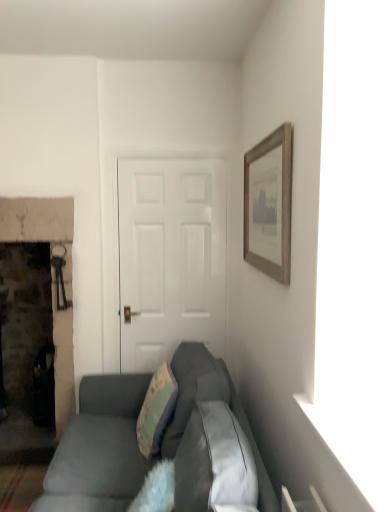
Measure the distance between point (38,405) and camera.

They are 2.91 meters apart.

Where is `wooden framed print at upper right`? wooden framed print at upper right is located at coordinates (269, 204).

Where is `trash bin/can below the wooden framed print at upper right (from a real-world perspective)`? This screenshot has height=512, width=384. trash bin/can below the wooden framed print at upper right (from a real-world perspective) is located at coordinates (44, 387).

Is black plastic trash can at left to the left or to the right of wooden framed print at upper right in the image?

black plastic trash can at left is positioned on wooden framed print at upper right's left side.

Is black plastic trash can at left thinner than wooden framed print at upper right?

In fact, black plastic trash can at left might be wider than wooden framed print at upper right.

Consider the image. Is black plastic trash can at left aimed at wooden framed print at upper right?

No, black plastic trash can at left is not facing towards wooden framed print at upper right.

Between black plastic trash can at left and suede gray couch at lower center, which one has smaller width?

black plastic trash can at left is thinner.

From the image's perspective, which is above, black plastic trash can at left or suede gray couch at lower center?

black plastic trash can at left appears higher in the image.

From a real-world perspective, is black plastic trash can at left beneath suede gray couch at lower center?

No, from a real-world perspective, black plastic trash can at left is not below suede gray couch at lower center.

How many degrees apart are the facing directions of black plastic trash can at left and suede gray couch at lower center?

The angular difference between black plastic trash can at left and suede gray couch at lower center is 89.4 degrees.

Is suede gray couch at lower center completely or partially outside of wooden framed print at upper right?

suede gray couch at lower center lies outside wooden framed print at upper right's area.

Between suede gray couch at lower center and wooden framed print at upper right, which one has more height?

suede gray couch at lower center is taller.

Is suede gray couch at lower center in contact with wooden framed print at upper right?

suede gray couch at lower center and wooden framed print at upper right are clearly separated.

From a real-world perspective, which is physically above, suede gray couch at lower center or wooden framed print at upper right?

In real-world perspective, wooden framed print at upper right is above.

Is suede gray couch at lower center touching teal fabric pillow at center?

suede gray couch at lower center is not next to teal fabric pillow at center, and they're not touching.

Which object is closer to the camera, suede gray couch at lower center or teal fabric pillow at center?

suede gray couch at lower center is closer to the camera.

From a real-world perspective, who is located higher, suede gray couch at lower center or teal fabric pillow at center?

teal fabric pillow at center.

Is teal fabric pillow at center located within black plastic trash can at left?

No, teal fabric pillow at center is not inside black plastic trash can at left.

Is black plastic trash can at left facing away from teal fabric pillow at center?

That's not correct — black plastic trash can at left is not looking away from teal fabric pillow at center.

Between black plastic trash can at left and teal fabric pillow at center, which one has larger width?

black plastic trash can at left is wider.

In terms of height, does wooden framed print at upper right look taller or shorter compared to suede gray couch at lower center?

Clearly, wooden framed print at upper right is shorter compared to suede gray couch at lower center.

Based on the photo, which is less distant, (248, 252) or (132, 434)?

Point (248, 252) appears to be closer to the viewer than point (132, 434).

Where is `picture frame on the right of suede gray couch at lower center`? The width and height of the screenshot is (384, 512). picture frame on the right of suede gray couch at lower center is located at coordinates (269, 204).

Is the depth of wooden framed print at upper right greater than that of suede gray couch at lower center?

That is True.

Based on the photo, how many degrees apart are the facing directions of teal fabric pillow at center and wooden framed print at upper right?

The angle between the facing direction of teal fabric pillow at center and the facing direction of wooden framed print at upper right is 6.16 degrees.

Is point (166, 377) farther from camera compared to point (248, 239)?

That is True.

Considering the relative sizes of teal fabric pillow at center and wooden framed print at upper right in the image provided, is teal fabric pillow at center thinner than wooden framed print at upper right?

No.

In the image, is teal fabric pillow at center positioned in front of or behind wooden framed print at upper right?

Clearly, teal fabric pillow at center is behind wooden framed print at upper right.

Locate an element on the screen. picture frame above the black plastic trash can at left (from a real-world perspective) is located at coordinates (269, 204).

At what (x,y) coordinates should I click in order to perform the action: click on studio couch that appears below the black plastic trash can at left (from a real-world perspective). Please return your answer as a coordinate pair (x, y). This screenshot has height=512, width=384. Looking at the image, I should click on (99, 449).

Based on their spatial positions, is teal fabric pillow at center or suede gray couch at lower center closer to wooden framed print at upper right?

teal fabric pillow at center lies closer to wooden framed print at upper right than the other object.

Looking at the image, which one is located closer to wooden framed print at upper right, black plastic trash can at left or suede gray couch at lower center?

Among the two, suede gray couch at lower center is located nearer to wooden framed print at upper right.

When comparing their distances from suede gray couch at lower center, does wooden framed print at upper right or teal fabric pillow at center seem closer?

Based on the image, teal fabric pillow at center appears to be nearer to suede gray couch at lower center.

Which object lies nearer to the anchor point suede gray couch at lower center, black plastic trash can at left or wooden framed print at upper right?

black plastic trash can at left.

Which object lies nearer to the anchor point teal fabric pillow at center, black plastic trash can at left or suede gray couch at lower center?

The object closer to teal fabric pillow at center is suede gray couch at lower center.

Which object lies nearer to the anchor point suede gray couch at lower center, wooden framed print at upper right or black plastic trash can at left?

Based on the image, black plastic trash can at left appears to be nearer to suede gray couch at lower center.

From the image, which object appears to be farther from wooden framed print at upper right, teal fabric pillow at center or black plastic trash can at left?

black plastic trash can at left lies further to wooden framed print at upper right than the other object.

Considering their positions, is suede gray couch at lower center positioned further to wooden framed print at upper right than teal fabric pillow at center?

Among the two, suede gray couch at lower center is located further to wooden framed print at upper right.

This screenshot has width=384, height=512. Find the location of `pillow between wooden framed print at upper right and suede gray couch at lower center in the vertical direction`. pillow between wooden framed print at upper right and suede gray couch at lower center in the vertical direction is located at coordinates (156, 410).

Find the location of a particular element. The image size is (384, 512). pillow between suede gray couch at lower center and black plastic trash can at left along the z-axis is located at coordinates (156, 410).

What are the coordinates of `pillow situated between black plastic trash can at left and wooden framed print at upper right from left to right` in the screenshot? It's located at (156, 410).

The image size is (384, 512). In order to click on picture frame between suede gray couch at lower center and black plastic trash can at left from front to back in this screenshot , I will do `click(269, 204)`.